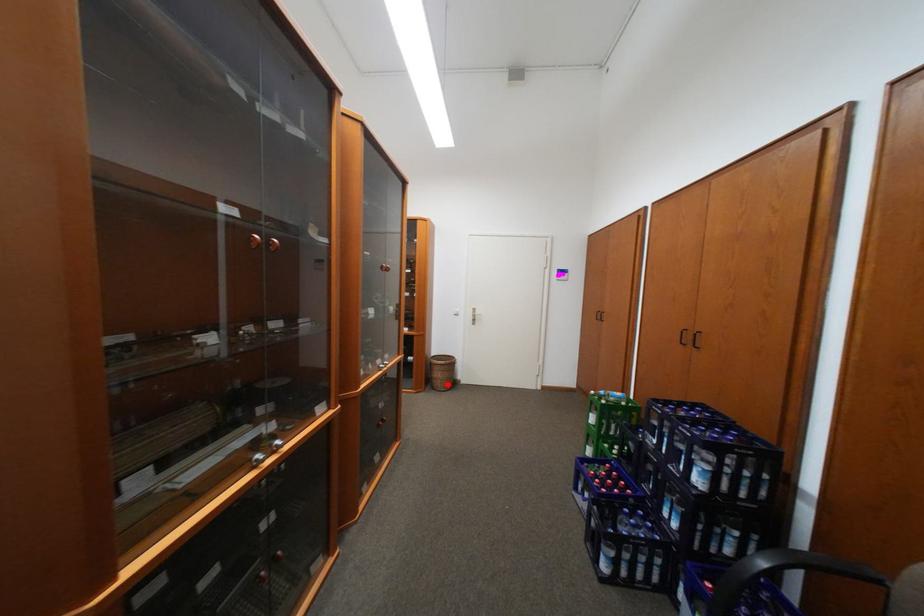
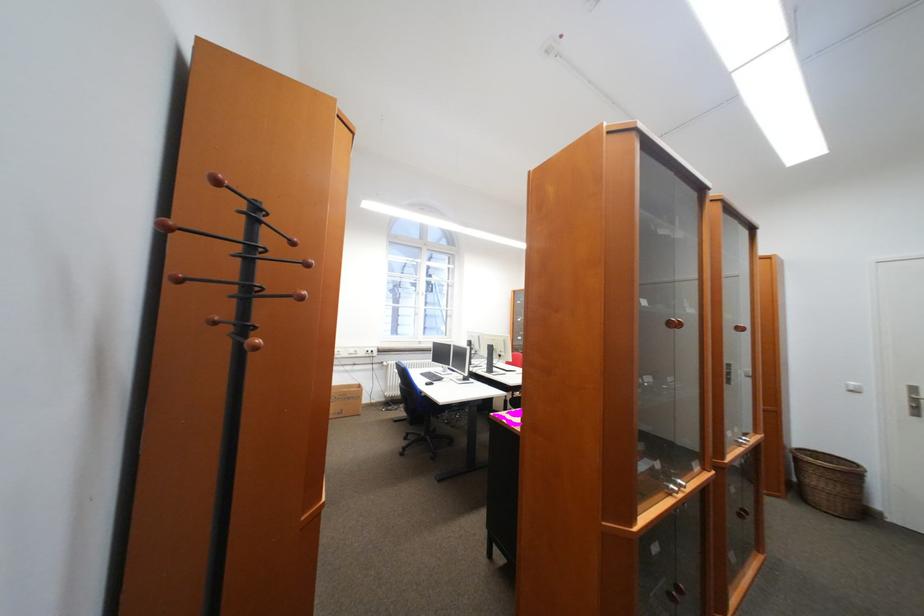
Question: I am providing you with two images of the same scene from different viewpoints. In image1, a red point is highlighted. Considering the same 3D point in image2, which of the following is correct?

Choices:
 (A) It is closer
 (B) It is farther

Answer: (A)